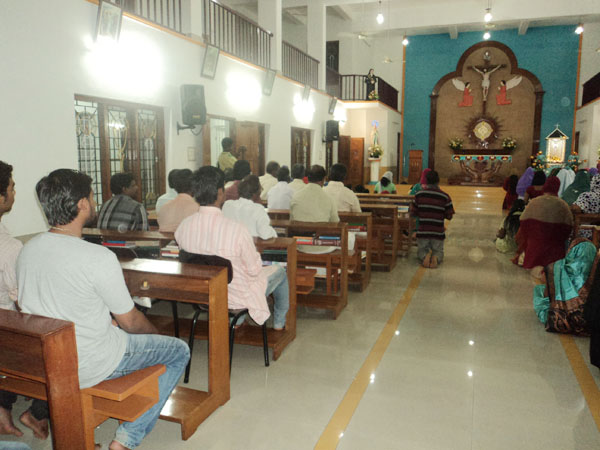
The height and width of the screenshot is (450, 600). What are the coordinates of `floor` in the screenshot? It's located at (461, 353).